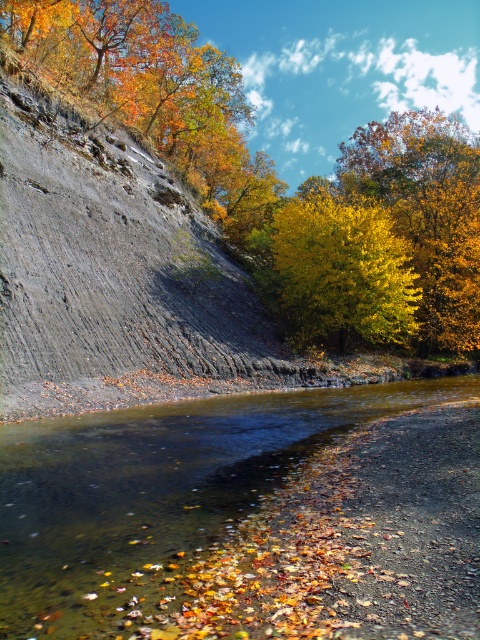
You are standing at the point marked by the coordinates point (245, 516) in the autumn scene. What type of geological formation are you currently on?

The point (245, 516) corresponds to the brown sedimentary rock at lower center, which is part of a layered sedimentary rock formation with horizontal strata, as described in the scene.